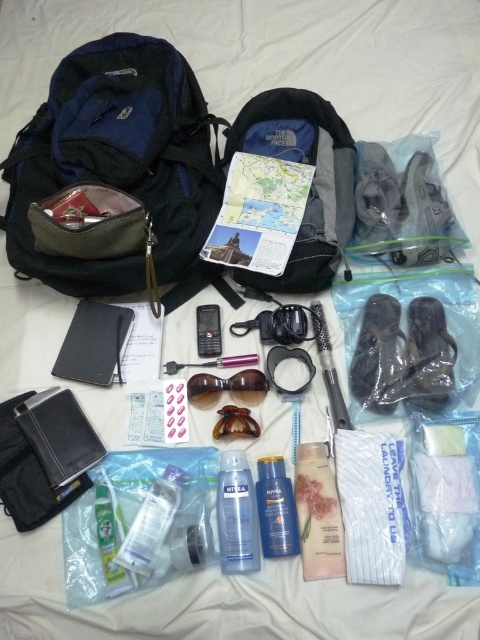
Does matte black backpack at upper left lie in front of blue matte lotion at center?

No, it is behind blue matte lotion at center.

Which is more to the left, matte black backpack at upper left or blue matte lotion at center?

From the viewer's perspective, matte black backpack at upper left appears more on the left side.

This screenshot has height=640, width=480. Identify the location of matte black backpack at upper left. (118, 161).

Identify the location of matte black backpack at upper left. The width and height of the screenshot is (480, 640). 118,161.

Can you confirm if matte black backpack at upper left is positioned above black plastic phone at center?

Indeed, matte black backpack at upper left is positioned over black plastic phone at center.

Image resolution: width=480 pixels, height=640 pixels. What do you see at coordinates (118, 161) in the screenshot?
I see `matte black backpack at upper left` at bounding box center [118, 161].

The width and height of the screenshot is (480, 640). Describe the element at coordinates (118, 161) in the screenshot. I see `matte black backpack at upper left` at that location.

Identify the location of matte black backpack at upper left. (118, 161).

Between point (255, 392) and point (312, 305), which one is positioned in front?

Point (255, 392)

Is browny amber plastic goggles at center smaller than clear plastic hairbrush at center?

Correct, browny amber plastic goggles at center occupies less space than clear plastic hairbrush at center.

Image resolution: width=480 pixels, height=640 pixels. I want to click on browny amber plastic goggles at center, so click(x=227, y=387).

Locate an element on the screen. Image resolution: width=480 pixels, height=640 pixels. browny amber plastic goggles at center is located at coordinates (227, 387).